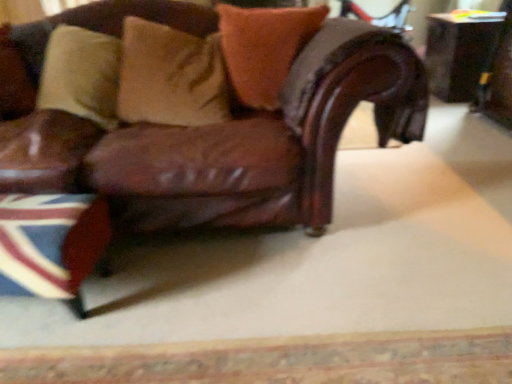
Locate an element on the screen. free region under union jack fabric at lower left (from a real-world perspective) is located at coordinates [44, 307].